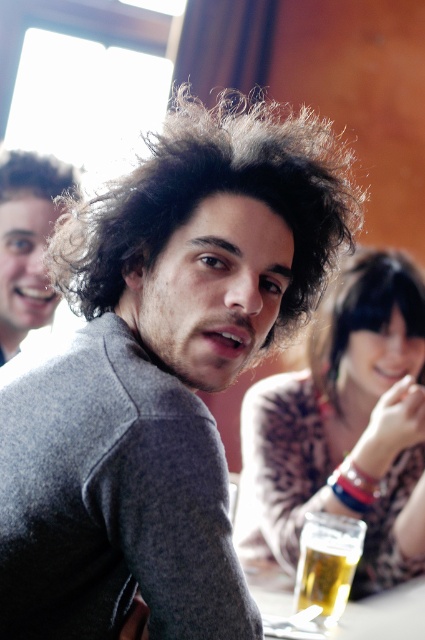
Who is taller, fur-like sweater at center or matte black hair at upper left?

With more height is fur-like sweater at center.

In the scene shown: Can you confirm if fur-like sweater at center is positioned below matte black hair at upper left?

Yes, fur-like sweater at center is below matte black hair at upper left.

This screenshot has height=640, width=425. Describe the element at coordinates (343, 426) in the screenshot. I see `fur-like sweater at center` at that location.

Find the location of a particular element. fur-like sweater at center is located at coordinates (343, 426).

Who is shorter, translucent glass beer at lower center or dark curly hair at upper left?

With less height is dark curly hair at upper left.

Is point (317, 596) in front of point (53, 182)?

Yes, point (317, 596) is closer to viewer.

Where is `translucent glass beer at lower center`? This screenshot has width=425, height=640. translucent glass beer at lower center is located at coordinates (326, 563).

Can you confirm if matte black hair at upper left is positioned above dark curly hair at upper left?

Incorrect, matte black hair at upper left is not positioned above dark curly hair at upper left.

Is matte black hair at upper left smaller than dark curly hair at upper left?

Incorrect, matte black hair at upper left is not smaller in size than dark curly hair at upper left.

Which is in front, point (17, 296) or point (10, 156)?

Point (17, 296) is in front.

Locate an element on the screen. matte black hair at upper left is located at coordinates (28, 241).